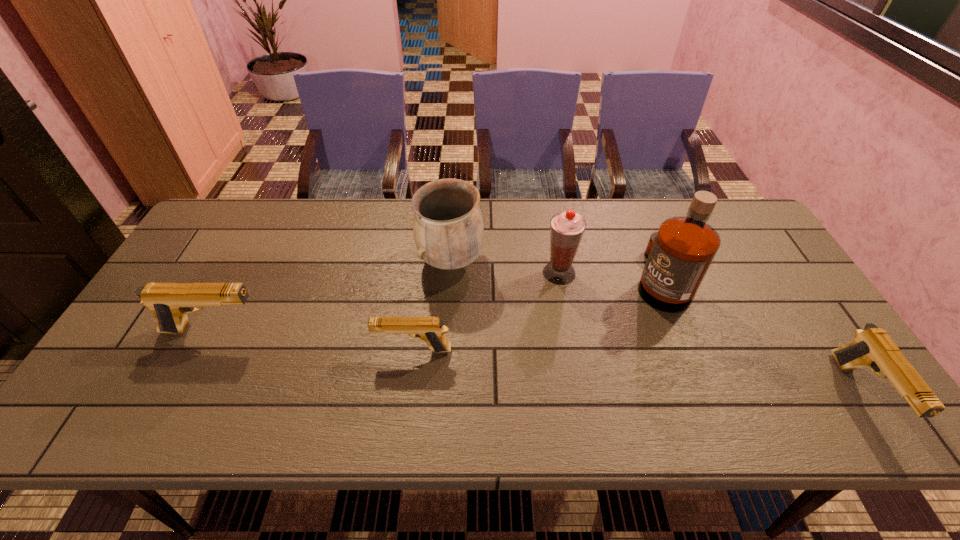
Find the location of a particular element. The image size is (960, 540). vacant space located at the barrel of the third nearest object is located at coordinates (420, 330).

This screenshot has width=960, height=540. I want to click on vacant space located 0.330m at the barrel of the shortest object, so click(242, 350).

Locate an element on the screen. The image size is (960, 540). free space located at the barrel of the shortest object is located at coordinates (278, 350).

Where is `free space located 0.270m at the barrel of the shortest object`? free space located 0.270m at the barrel of the shortest object is located at coordinates (267, 350).

Identify the location of vacant space situated 0.300m on the right of the third object from right to left. This screenshot has height=540, width=960. (679, 273).

You are a GUI agent. You are given a task and a screenshot of the screen. Output one action in this format:
    pyautogui.click(x=<x>, y=<y>)
    Task: Click on the vacant space located 0.190m on the front label of the tallest object
    The image size is (960, 540).
    Given the screenshot: What is the action you would take?
    pyautogui.click(x=567, y=279)

Locate an element on the screen. This screenshot has height=540, width=960. free space located on the front label of the tallest object is located at coordinates (532, 279).

Find the location of a particular element. vacant space situated 0.390m on the front label of the tallest object is located at coordinates (497, 279).

Locate an element on the screen. free space located 0.070m on the right of the urn is located at coordinates (507, 261).

Locate an element on the screen. The image size is (960, 540). object located at the far edge is located at coordinates (448, 230).